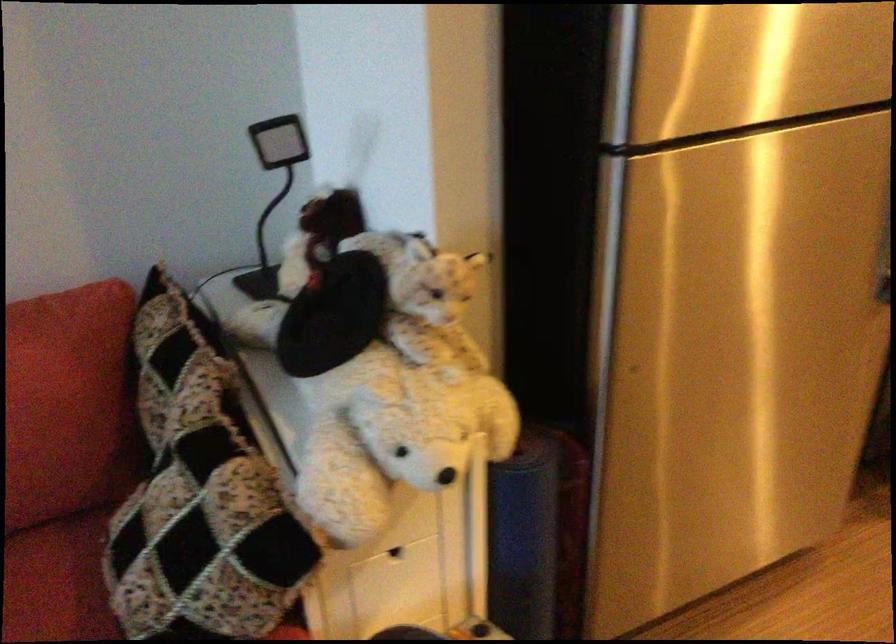
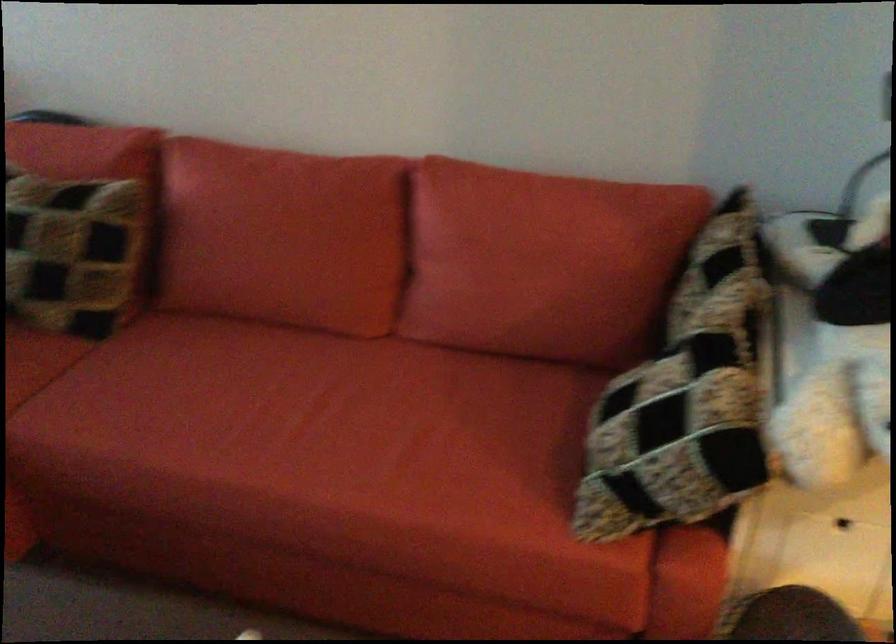
The point at (273, 411) is marked in the first image. Where is the corresponding point in the second image?

(787, 341)